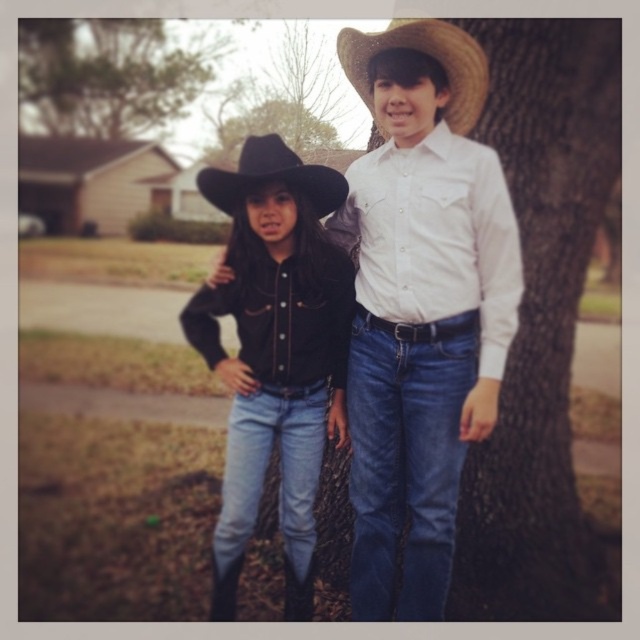
Question: Which object is the closest to the black felt fedora at center?

Choices:
 (A) strawmaterial/texturecowboy hat at upper center
 (B) black matte cowboy hat at center
 (C) white matte shirt at center

Answer: (A)

Question: Which object is closer to the camera taking this photo?

Choices:
 (A) white matte shirt at center
 (B) black matte cowboy hat at center
 (C) strawmaterial/texturecowboy hat at upper center

Answer: (C)

Question: Is strawmaterial/texturecowboy hat at upper center above black felt fedora at center?

Choices:
 (A) yes
 (B) no

Answer: (A)

Question: Which point appears closest to the camera in this image?

Choices:
 (A) (449, 40)
 (B) (204, 186)
 (C) (35, 60)

Answer: (A)

Question: Does green leafy tree at upper left appear on the left side of strawmaterial/texturecowboy hat at upper center?

Choices:
 (A) yes
 (B) no

Answer: (A)

Question: Does white matte shirt at center appear on the right side of green leafy tree at upper left?

Choices:
 (A) yes
 (B) no

Answer: (A)